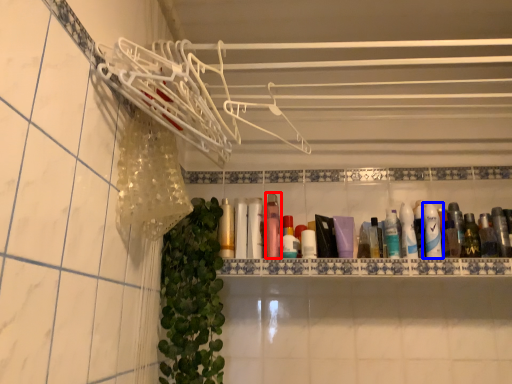
Question: Which object appears farthest to the camera in this image, mouthwash (highlighted by a red box) or shaving cream (highlighted by a blue box)?

Choices:
 (A) mouthwash
 (B) shaving cream

Answer: (A)